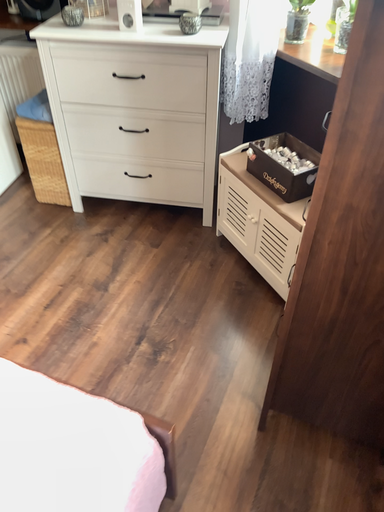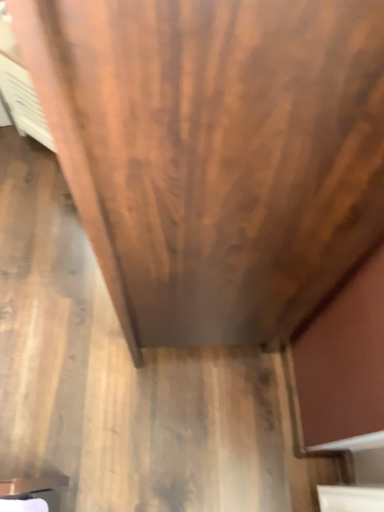
Question: Which way did the camera rotate in the video?

Choices:
 (A) rotated right
 (B) rotated left

Answer: (A)